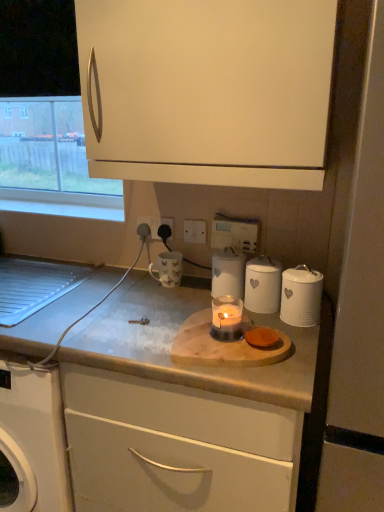
The width and height of the screenshot is (384, 512). Find the location of `free space above matte white cutting board at center, arranged as the first cabinetry when ordered from the bottom (from a real-world perspective)`. free space above matte white cutting board at center, arranged as the first cabinetry when ordered from the bottom (from a real-world perspective) is located at coordinates pos(181,315).